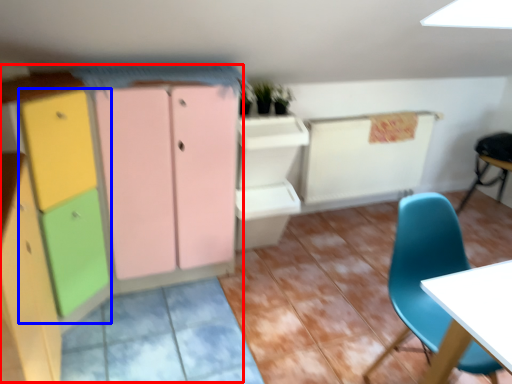
Question: Which object is closer to the camera taking this photo, dresser (highlighted by a red box) or cabinetry (highlighted by a blue box)?

Choices:
 (A) dresser
 (B) cabinetry

Answer: (A)